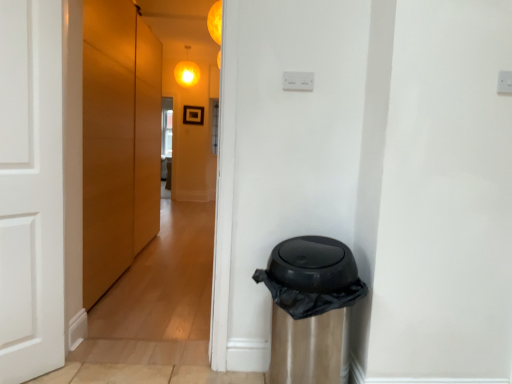
At what (x,y) coordinates should I click in order to perform the action: click on matte wood door at left. Please return your answer as a coordinate pair (x, y). This screenshot has width=512, height=384. Looking at the image, I should click on (118, 141).

What do you see at coordinates (187, 73) in the screenshot?
I see `matte yellow globe at upper center, the second light in the bottom-to-top sequence` at bounding box center [187, 73].

Describe the element at coordinates (310, 309) in the screenshot. I see `black plastic waste bin at lower right` at that location.

This screenshot has height=384, width=512. Identify the location of matte wood door at left. (118, 141).

In the scene shown: Is matte wood door at left positioned far away from orange matte light at upper center, arranged as the 2th light when viewed from the top?

Yes.

Which of these two, matte wood door at left or orange matte light at upper center, the second light in the back-to-front sequence, is bigger?

Bigger between the two is matte wood door at left.

How distant is matte wood door at left from orange matte light at upper center, marked as the first light in a right-to-left arrangement?

A distance of 1.78 meters exists between matte wood door at left and orange matte light at upper center, marked as the first light in a right-to-left arrangement.

From the image's perspective, which is below, matte wood door at left or orange matte light at upper center, which appears as the 1th light when ordered from the bottom?

matte wood door at left.

Is black plastic waste bin at lower right far from matte yellow globe at upper center, which is the second light in right-to-left order?

Yes, black plastic waste bin at lower right is far from matte yellow globe at upper center, which is the second light in right-to-left order.

Based on their positions, is black plastic waste bin at lower right located to the left or right of matte yellow globe at upper center, the second light in the bottom-to-top sequence?

black plastic waste bin at lower right is positioned on matte yellow globe at upper center, the second light in the bottom-to-top sequence,'s right side.

Does point (338, 272) lie behind point (192, 73)?

No, (338, 272) is closer to viewer.

Is black plastic waste bin at lower right far from matte wood door at left?

Indeed, black plastic waste bin at lower right is not near matte wood door at left.

Is black plastic waste bin at lower right spatially inside matte wood door at left, or outside of it?

black plastic waste bin at lower right is located beyond the bounds of matte wood door at left.

Consider the image. How different are the orientations of black plastic waste bin at lower right and matte wood door at left in degrees?

The facing directions of black plastic waste bin at lower right and matte wood door at left are 90.4 degrees apart.

From the image's perspective, is matte yellow globe at upper center, which is the 1th light in left-to-right order, above or below black plastic waste bin at lower right?

matte yellow globe at upper center, which is the 1th light in left-to-right order, is situated higher than black plastic waste bin at lower right in the image.

From a real-world perspective, which object stands above the other?

matte yellow globe at upper center, which is the 1th light in left-to-right order.

Which is closer to the camera, [185,86] or [338,288]?

Point [338,288]

What's the angular difference between matte yellow globe at upper center, which is the second light in right-to-left order, and black plastic waste bin at lower right's facing directions?

The angular difference between matte yellow globe at upper center, which is the second light in right-to-left order, and black plastic waste bin at lower right is 0.367 degrees.

Where is `light that appears behind the orange matte light at upper center, arranged as the 2th light when viewed from the top`? This screenshot has width=512, height=384. light that appears behind the orange matte light at upper center, arranged as the 2th light when viewed from the top is located at coordinates (187, 73).

Considering the relative sizes of orange matte light at upper center, arranged as the 2th light when viewed from the top, and matte yellow globe at upper center, which ranks as the 1th light in top-to-bottom order, in the image provided, is orange matte light at upper center, arranged as the 2th light when viewed from the top, taller than matte yellow globe at upper center, which ranks as the 1th light in top-to-bottom order,?

No, orange matte light at upper center, arranged as the 2th light when viewed from the top, is not taller than matte yellow globe at upper center, which ranks as the 1th light in top-to-bottom order.

From a real-world perspective, does orange matte light at upper center, which appears as the 1th light when ordered from the bottom, stand above matte yellow globe at upper center, which is the second light in right-to-left order?

Incorrect, from a real-world perspective, orange matte light at upper center, which appears as the 1th light when ordered from the bottom, is lower than matte yellow globe at upper center, which is the second light in right-to-left order.

Considering the relative positions of orange matte light at upper center, which appears as the 1th light when ordered from the bottom, and matte yellow globe at upper center, which is the second light in right-to-left order, in the image provided, is orange matte light at upper center, which appears as the 1th light when ordered from the bottom, to the left of matte yellow globe at upper center, which is the second light in right-to-left order, from the viewer's perspective?

In fact, orange matte light at upper center, which appears as the 1th light when ordered from the bottom, is to the right of matte yellow globe at upper center, which is the second light in right-to-left order.

From the image's perspective, is orange matte light at upper center, placed as the second light when sorted from left to right, over black plastic waste bin at lower right?

Yes, from the image's perspective, orange matte light at upper center, placed as the second light when sorted from left to right, is on top of black plastic waste bin at lower right.

Is orange matte light at upper center, the second light in the back-to-front sequence, wider or thinner than black plastic waste bin at lower right?

In the image, orange matte light at upper center, the second light in the back-to-front sequence, appears to be more narrow than black plastic waste bin at lower right.

From a real-world perspective, is orange matte light at upper center, placed as the second light when sorted from left to right, above or below black plastic waste bin at lower right?

orange matte light at upper center, placed as the second light when sorted from left to right, is situated higher than black plastic waste bin at lower right in the real world.

Is matte wood door at left in front of or behind black plastic waste bin at lower right in the image?

Clearly, matte wood door at left is behind black plastic waste bin at lower right.

Which of these two, matte wood door at left or black plastic waste bin at lower right, is thinner?

matte wood door at left.

Is matte wood door at left taller or shorter than black plastic waste bin at lower right?

matte wood door at left is taller than black plastic waste bin at lower right.

Does matte wood door at left turn towards black plastic waste bin at lower right?

No, matte wood door at left is not facing towards black plastic waste bin at lower right.

Locate an element on the screen. The width and height of the screenshot is (512, 384). light on the right side of matte wood door at left is located at coordinates (215, 22).

What are the coordinates of `waste container beneath the matte yellow globe at upper center, which is the 1th light in left-to-right order (from a real-world perspective)` in the screenshot? It's located at (310, 309).

From the image, which object appears to be nearer to black plastic waste bin at lower right, matte yellow globe at upper center, the second light in the bottom-to-top sequence, or orange matte light at upper center, which is the first light in front-to-back order?

Based on the image, orange matte light at upper center, which is the first light in front-to-back order, appears to be nearer to black plastic waste bin at lower right.

When comparing their distances from matte yellow globe at upper center, which is the 1th light in left-to-right order, does matte wood door at left or orange matte light at upper center, which is the first light in front-to-back order, seem further?

The object further to matte yellow globe at upper center, which is the 1th light in left-to-right order, is orange matte light at upper center, which is the first light in front-to-back order.

From the image, which object appears to be farther from matte yellow globe at upper center, which is the second light in right-to-left order, black plastic waste bin at lower right or matte wood door at left?

black plastic waste bin at lower right lies further to matte yellow globe at upper center, which is the second light in right-to-left order, than the other object.

From the image, which object appears to be nearer to orange matte light at upper center, marked as the first light in a right-to-left arrangement, matte yellow globe at upper center, which is the 1th light in left-to-right order, or black plastic waste bin at lower right?

The object closer to orange matte light at upper center, marked as the first light in a right-to-left arrangement, is black plastic waste bin at lower right.

From the image, which object appears to be nearer to matte wood door at left, matte yellow globe at upper center, which ranks as the 1th light in top-to-bottom order, or orange matte light at upper center, the second light in the back-to-front sequence?

orange matte light at upper center, the second light in the back-to-front sequence, lies closer to matte wood door at left than the other object.

Looking at this image, based on their spatial positions, is orange matte light at upper center, marked as the first light in a right-to-left arrangement, or matte wood door at left further from matte yellow globe at upper center, the first light viewed from the back?

Based on the image, orange matte light at upper center, marked as the first light in a right-to-left arrangement, appears to be further to matte yellow globe at upper center, the first light viewed from the back.

Looking at the image, which one is located closer to black plastic waste bin at lower right, matte wood door at left or orange matte light at upper center, marked as the first light in a right-to-left arrangement?

The object closer to black plastic waste bin at lower right is orange matte light at upper center, marked as the first light in a right-to-left arrangement.

Estimate the real-world distances between objects in this image. Which object is further from matte yellow globe at upper center, the second light in the bottom-to-top sequence, orange matte light at upper center, which is the first light in front-to-back order, or black plastic waste bin at lower right?

black plastic waste bin at lower right.

Where is `light between black plastic waste bin at lower right and matte yellow globe at upper center, which is counted as the 2th light, starting from the front, from front to back`? Image resolution: width=512 pixels, height=384 pixels. light between black plastic waste bin at lower right and matte yellow globe at upper center, which is counted as the 2th light, starting from the front, from front to back is located at coordinates (215, 22).

Image resolution: width=512 pixels, height=384 pixels. In order to click on door between black plastic waste bin at lower right and orange matte light at upper center, marked as the first light in a right-to-left arrangement, in the front-back direction in this screenshot , I will do `click(118, 141)`.

Find the location of a particular element. The width and height of the screenshot is (512, 384). light between matte wood door at left and matte yellow globe at upper center, which is the second light in right-to-left order, along the z-axis is located at coordinates (215, 22).

The height and width of the screenshot is (384, 512). I want to click on door between black plastic waste bin at lower right and matte yellow globe at upper center, which is counted as the 2th light, starting from the front, in the front-back direction, so [x=118, y=141].